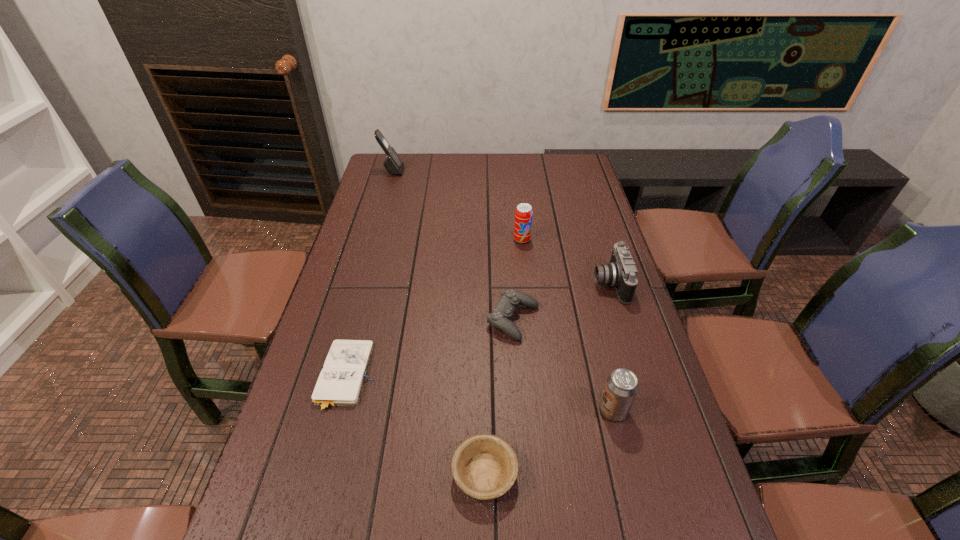
I want to click on notebook at the left edge, so coord(340,382).

The height and width of the screenshot is (540, 960). Find the location of `beer can at the right edge`. beer can at the right edge is located at coordinates (621, 387).

Where is `camera located at the right edge`? This screenshot has width=960, height=540. camera located at the right edge is located at coordinates point(621,272).

The height and width of the screenshot is (540, 960). Identify the location of object located in the far left corner section of the desktop. (394, 165).

This screenshot has width=960, height=540. I want to click on vacant space at the far edge of the desktop, so click(x=448, y=157).

The height and width of the screenshot is (540, 960). I want to click on free space at the left edge of the desktop, so click(394, 221).

The height and width of the screenshot is (540, 960). What are the coordinates of `vacant space at the right edge of the desktop` in the screenshot? It's located at (607, 249).

You are a GUI agent. You are given a task and a screenshot of the screen. Output one action in this format:
    pyautogui.click(x=<x>, y=<y>)
    Task: Click on the vacant space at the far left corner
    
    Given the screenshot: What is the action you would take?
    pyautogui.click(x=408, y=160)

The image size is (960, 540). I want to click on vacant space in between the second farthest object and the camera, so click(x=565, y=262).

I want to click on free space between the cellular telephone and the soda can, so click(x=457, y=205).